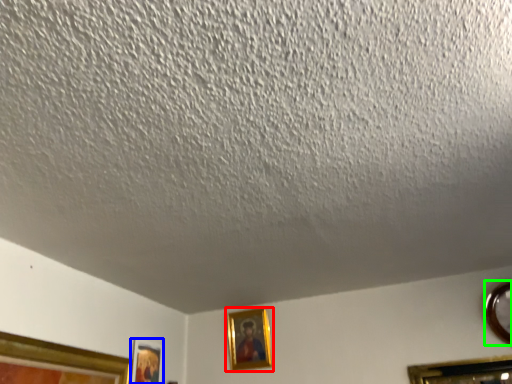
Question: Which is nearer to the picture frame (highlighted by a red box)? picture frame (highlighted by a blue box) or picture frame (highlighted by a green box).

Choices:
 (A) picture frame
 (B) picture frame

Answer: (A)